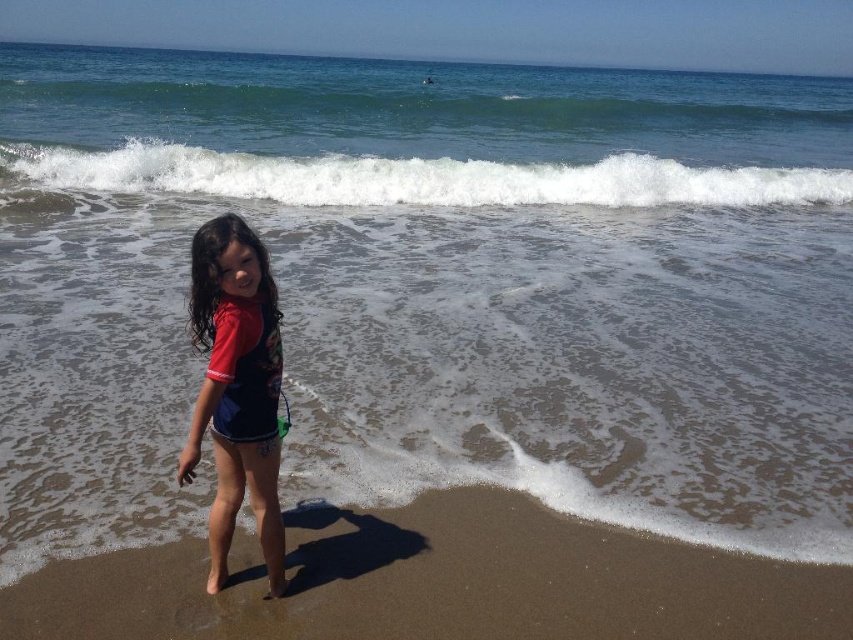
You are a lifeguard on duty and need to assess the beach and wave conditions. Based on the scene, which area is narrower between the brown sandy beach at lower center and the white frothy wave at upper center?

The brown sandy beach at lower center has a lesser width compared to the white frothy wave at upper center, so the brown sandy beach at lower center is narrower.